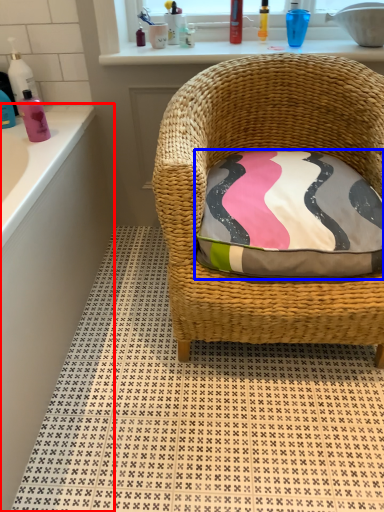
Question: Which object appears farthest to the camera in this image, bath (highlighted by a red box) or pillow (highlighted by a blue box)?

Choices:
 (A) bath
 (B) pillow

Answer: (B)